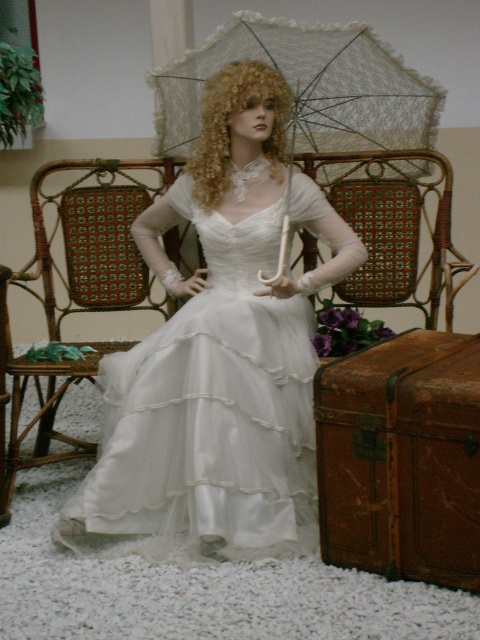
You are standing in front of the mannequin and want to take a photo. You notice two points on the dress, one at coordinates point (33,186) and another at point (436,269). Which point is closer to your camera lens?

Point (33,186) is further to the camera than point (436,269).

You are a customer in a boutique store and see the white lace umbrella at center and the woven wood chair at center. Which object is covering the other?

The white lace umbrella at center is positioned over the woven wood chair at center, so the umbrella is covering the chair.

You are standing in front of the mannequin and want to touch one of the two points on the dress. Which point, point (x=294, y=333) or point (x=385, y=90), is closer to you?

Point (x=294, y=333) is closer to the camera than point (x=385, y=90), so you can reach it more easily.